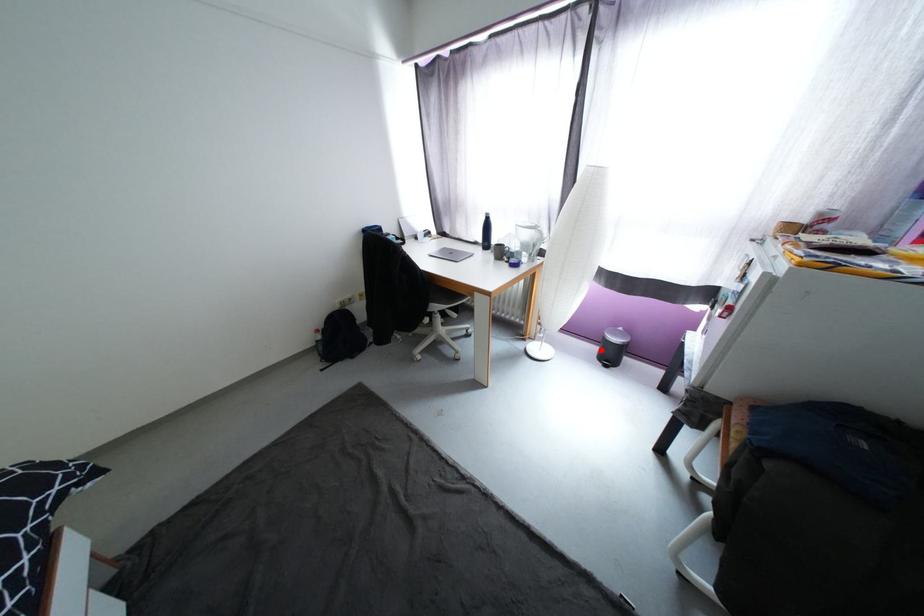
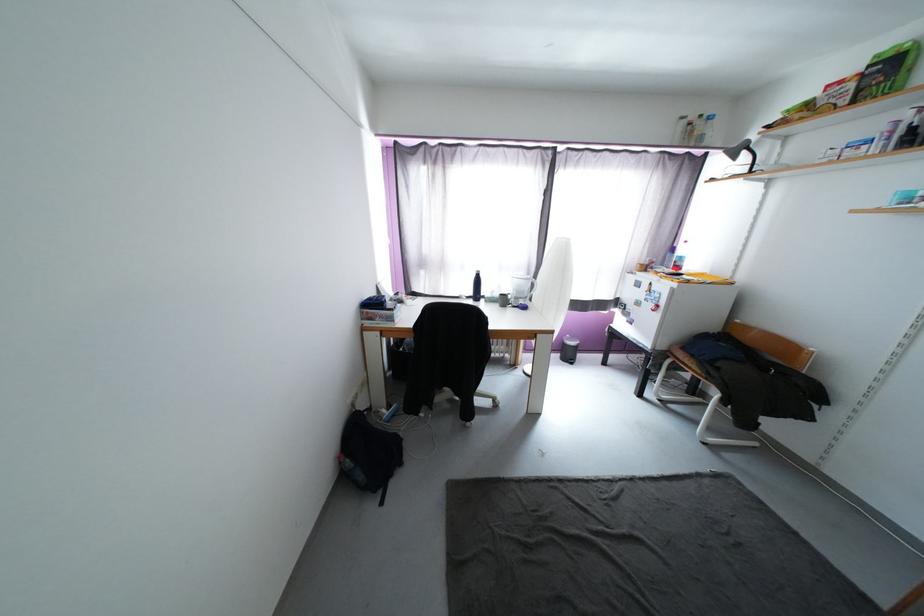
In the second image, find the point that corresponds to the highlighted location in the first image.

(564, 357)